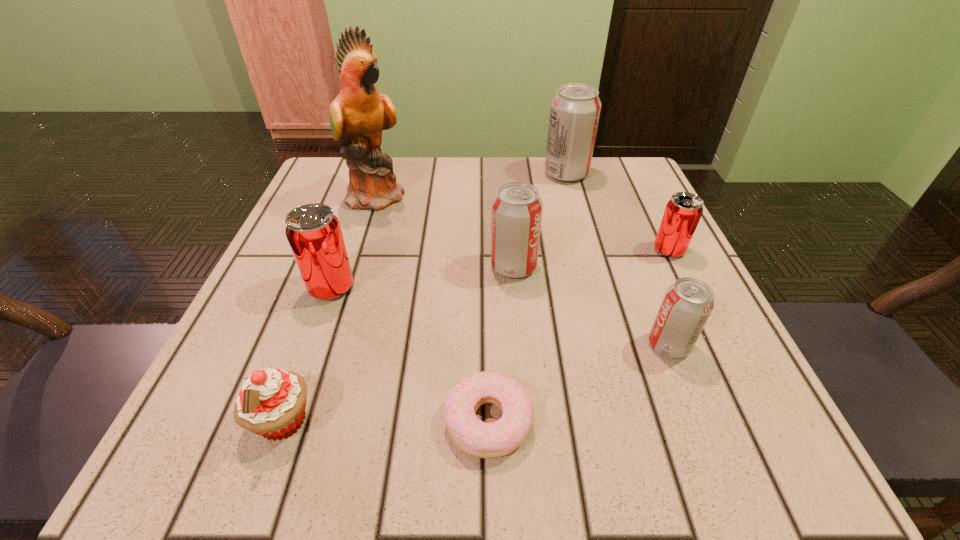
Choose which soda can is the third nearest neighbor to the shortest object. Please provide its 2D coordinates. Your answer should be formatted as a tuple, i.e. [(x, y)], where the tuple contains the x and y coordinates of a point satisfying the conditions above.

[(314, 233)]

The width and height of the screenshot is (960, 540). Find the location of `the second closest soda can to the leftmost gray soda can`. the second closest soda can to the leftmost gray soda can is located at coordinates pyautogui.click(x=683, y=211).

Locate an element on the screen. The image size is (960, 540). the second closest gray soda can to the farthest gray soda can is located at coordinates (687, 304).

The image size is (960, 540). Identify the location of the closest gray soda can to the second nearest gray soda can. (687, 304).

Where is `vacant space that satisfies the following two spatial constraints: 1. on the back side of the nearest gray soda can; 2. on the front-facing side of the tallest object`? The width and height of the screenshot is (960, 540). vacant space that satisfies the following two spatial constraints: 1. on the back side of the nearest gray soda can; 2. on the front-facing side of the tallest object is located at coordinates (610, 195).

Identify the location of free spot that satisfies the following two spatial constraints: 1. on the front side of the bigger red soda can; 2. on the left side of the doughnut. (x=284, y=420).

Find the location of a particular element. The width and height of the screenshot is (960, 540). free location that satisfies the following two spatial constraints: 1. on the back side of the pink cupcake; 2. on the left side of the second biggest gray soda can is located at coordinates (338, 266).

Identify the location of vacant space that satisfies the following two spatial constraints: 1. on the back side of the second smallest gray soda can; 2. on the right side of the pink cupcake. Image resolution: width=960 pixels, height=540 pixels. click(x=338, y=266).

Find the location of `free space in the image that satisfies the following two spatial constraints: 1. on the front-facing side of the tallest object; 2. on the left side of the rightmost soda can`. free space in the image that satisfies the following two spatial constraints: 1. on the front-facing side of the tallest object; 2. on the left side of the rightmost soda can is located at coordinates (361, 250).